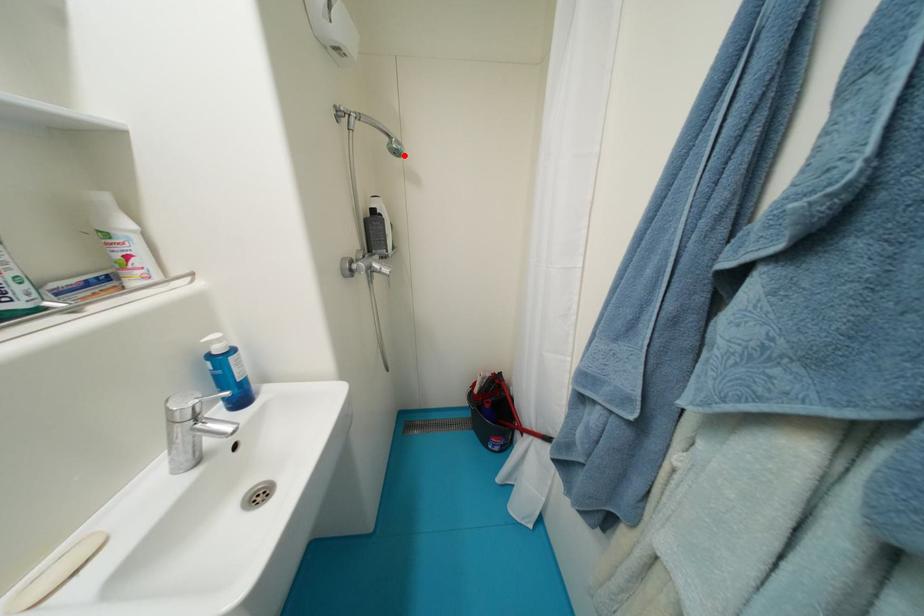
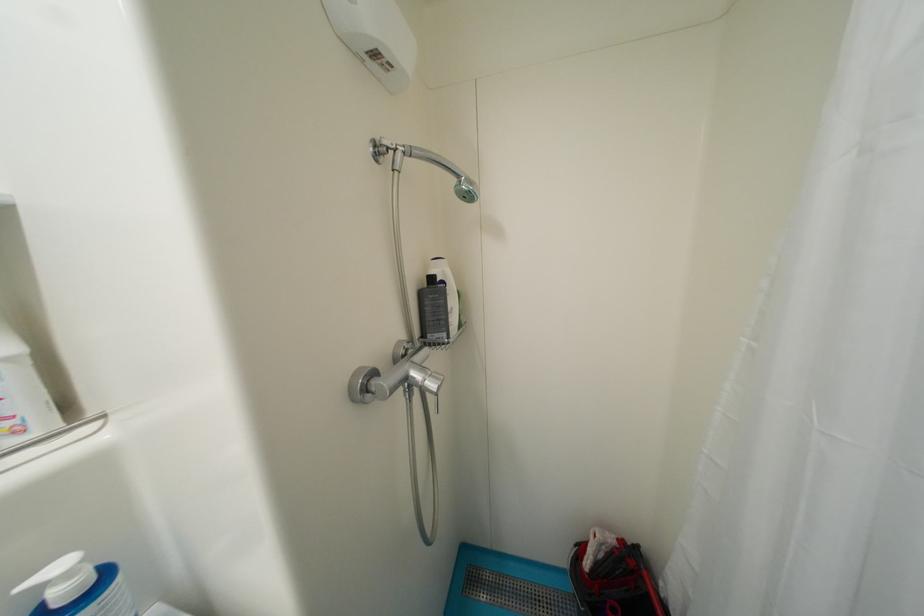
The point at the highlighted location is marked in the first image. Where is the corresponding point in the second image?

(476, 199)